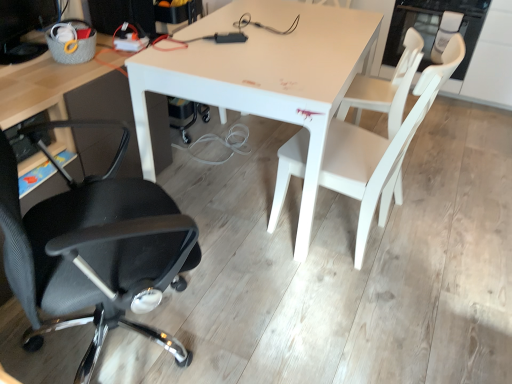
Question: Are white matte table at center and white matte chair at center, which is counted as the second chair, starting from the right, far apart?

Choices:
 (A) no
 (B) yes

Answer: (A)

Question: Can you confirm if white matte table at center is bigger than white matte chair at center, the 2th chair in the left-to-right sequence?

Choices:
 (A) yes
 (B) no

Answer: (A)

Question: Does white matte table at center appear on the right side of white matte chair at center, the 2th chair in the left-to-right sequence?

Choices:
 (A) no
 (B) yes

Answer: (A)

Question: Considering the relative sizes of white matte table at center and white matte chair at center, the 2th chair in the left-to-right sequence, in the image provided, is white matte table at center wider than white matte chair at center, the 2th chair in the left-to-right sequence,?

Choices:
 (A) no
 (B) yes

Answer: (B)

Question: From a real-world perspective, is white matte table at center physically above white matte chair at center, the 2th chair in the left-to-right sequence?

Choices:
 (A) yes
 (B) no

Answer: (B)

Question: Considering their positions, is white matte chair at center, the 2th chair in the left-to-right sequence, located in front of or behind matte black computer monitor at upper left?

Choices:
 (A) behind
 (B) front

Answer: (B)

Question: From a real-world perspective, is white matte chair at center, which is counted as the second chair, starting from the right, physically located above or below matte black computer monitor at upper left?

Choices:
 (A) above
 (B) below

Answer: (B)

Question: Looking at their shapes, would you say white matte chair at center, which is counted as the second chair, starting from the right, is wider or thinner than matte black computer monitor at upper left?

Choices:
 (A) thin
 (B) wide

Answer: (B)

Question: From the image's perspective, is white matte chair at center, the 2th chair in the left-to-right sequence, positioned above or below matte black computer monitor at upper left?

Choices:
 (A) below
 (B) above

Answer: (A)

Question: In terms of height, does black mesh office chair at left, arranged as the first chair when viewed from the left, look taller or shorter compared to matte black computer monitor at upper left?

Choices:
 (A) short
 (B) tall

Answer: (B)

Question: Is point (118, 215) positioned closer to the camera than point (48, 13)?

Choices:
 (A) farther
 (B) closer

Answer: (B)

Question: In terms of width, does black mesh office chair at left, arranged as the first chair when viewed from the left, look wider or thinner when compared to matte black computer monitor at upper left?

Choices:
 (A) thin
 (B) wide

Answer: (B)

Question: Based on their positions, is black mesh office chair at left, which is counted as the 3th chair, starting from the right, located to the left or right of matte black computer monitor at upper left?

Choices:
 (A) left
 (B) right

Answer: (B)

Question: Is white matte chair at right, acting as the third chair starting from the left, to the left or to the right of matte black computer monitor at upper left in the image?

Choices:
 (A) left
 (B) right

Answer: (B)

Question: Is point (354, 117) closer or farther from the camera than point (25, 59)?

Choices:
 (A) farther
 (B) closer

Answer: (A)